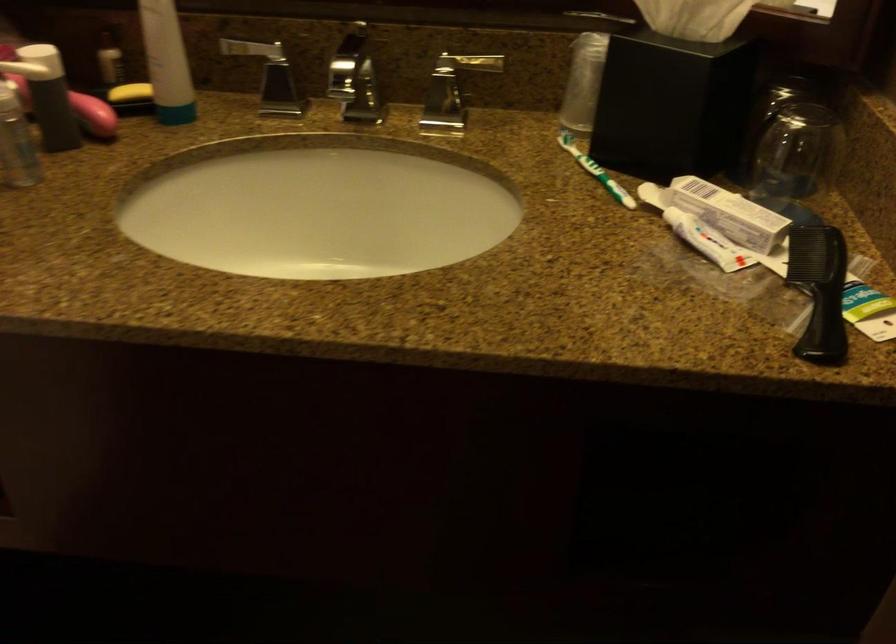
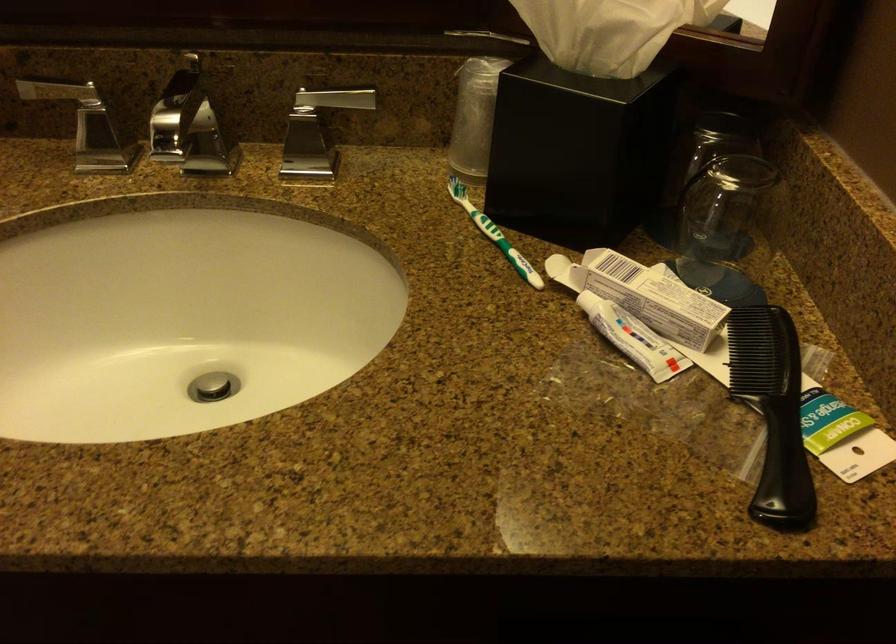
Where in the second image is the point corresponding to [597,169] from the first image?

(494, 234)